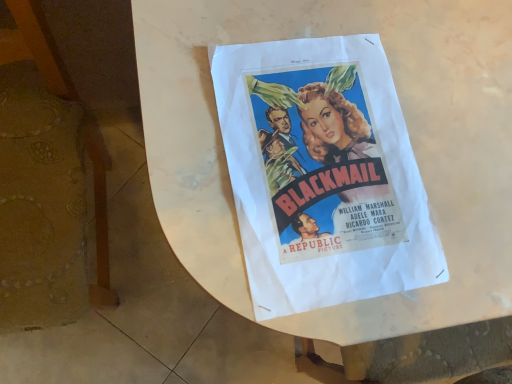
Identify the location of vacant region above matte paper poster at center (from a real-world perspective). (328, 157).